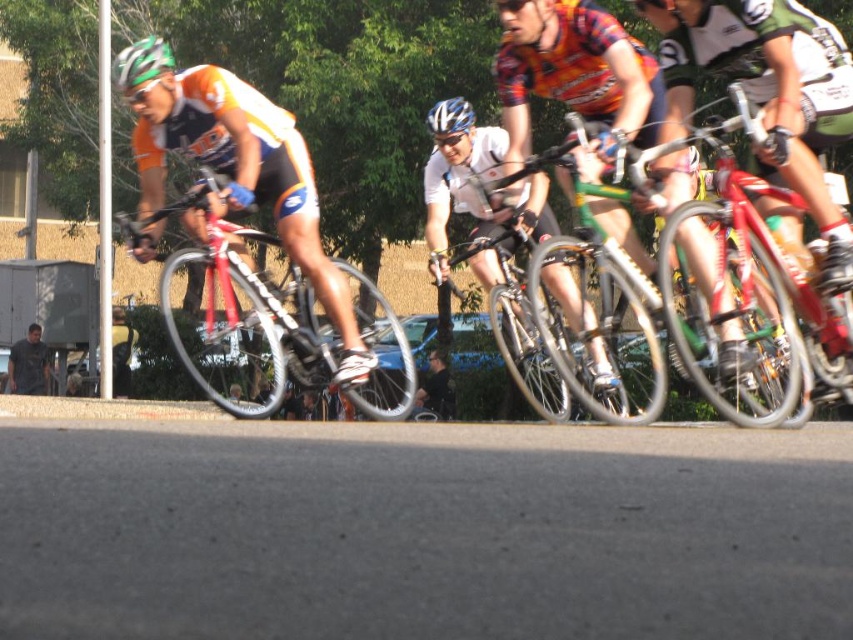
The image size is (853, 640). What do you see at coordinates (28, 364) in the screenshot? I see `dark gray shirt at lower left` at bounding box center [28, 364].

Is dark gray shirt at lower left closer to camera compared to green matte helmet at upper left?

No.

Who is more forward, [27,355] or [129,72]?

Point [129,72] is in front.

The image size is (853, 640). I want to click on dark gray shirt at lower left, so click(x=28, y=364).

The width and height of the screenshot is (853, 640). What do you see at coordinates (596, 282) in the screenshot? I see `green matte bicycle at center` at bounding box center [596, 282].

Is green matte bicycle at center above green matte helmet at upper left?

Actually, green matte bicycle at center is below green matte helmet at upper left.

Between point (619, 397) and point (143, 61), which one is positioned in front?

Point (143, 61) is in front.

Where is `green matte bicycle at center`? This screenshot has width=853, height=640. green matte bicycle at center is located at coordinates (596, 282).

Does shiny red bicycle at center have a larger size compared to green matte bicycle at center?

No.

Which of these two, shiny red bicycle at center or green matte bicycle at center, stands taller?

Standing taller between the two is shiny red bicycle at center.

Between point (764, 228) and point (599, 276), which one is positioned in front?

Positioned in front is point (764, 228).

At what (x,y) coordinates should I click in order to perform the action: click on shiny red bicycle at center. Please return your answer as a coordinate pair (x, y). This screenshot has height=640, width=853. Looking at the image, I should click on (749, 285).